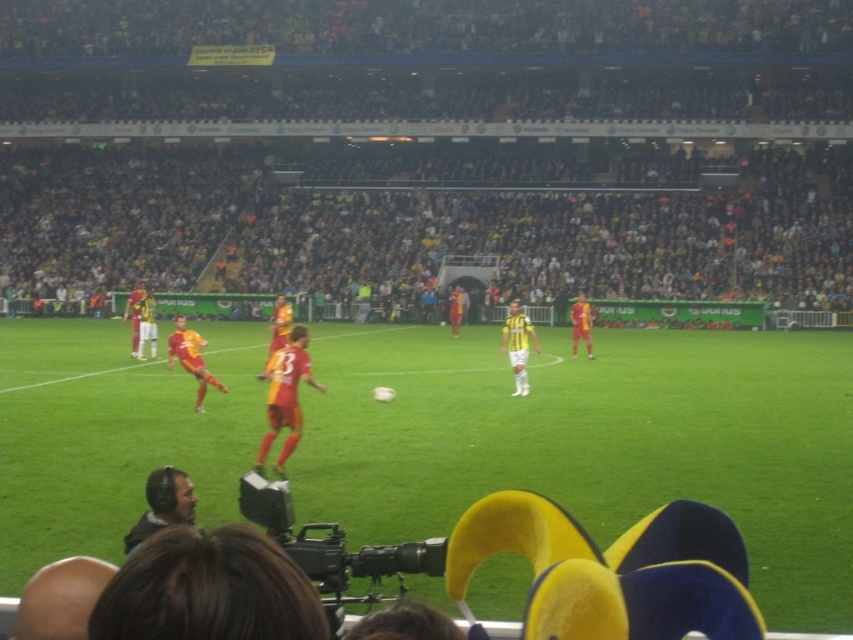
Question: Considering the relative positions of matte red soccer player at center and yellow matte jersey at center in the image provided, where is matte red soccer player at center located with respect to yellow matte jersey at center?

Choices:
 (A) below
 (B) above

Answer: (A)

Question: In this image, where is dark gray crowd at center located relative to matte black headphones at lower left?

Choices:
 (A) above
 (B) below

Answer: (A)

Question: Based on their relative distances, which object is nearer to the matte orange jersey at center?

Choices:
 (A) green grass football field at center
 (B) matte red soccer player at center
 (C) matte black headphones at lower left

Answer: (C)

Question: Which point is farther to the camera?

Choices:
 (A) (421, 120)
 (B) (515, 337)
 (C) (149, 333)

Answer: (A)

Question: Can you confirm if matte red soccer player at center is bigger than yellow matte jersey at center?

Choices:
 (A) yes
 (B) no

Answer: (A)

Question: Which of the following is the farthest from the observer?

Choices:
 (A) matte black headphones at lower left
 (B) yellow jersey at left
 (C) yellow matte jersey at center

Answer: (B)